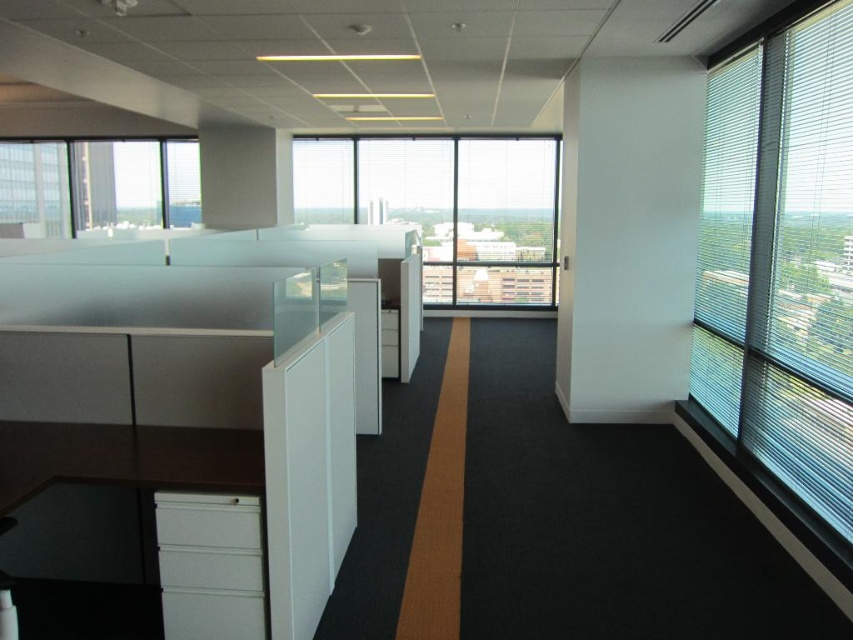
Does transparent glass window at right come in front of clear glass window at upper left?

Yes.

Does point (839, 276) come closer to viewer compared to point (86, 228)?

Yes, point (839, 276) is closer to viewer.

Between point (839, 314) and point (91, 208), which one is positioned behind?

Point (91, 208)

Locate an element on the screen. This screenshot has height=640, width=853. transparent glass window at right is located at coordinates (781, 259).

Does transparent glass window at right have a greater height compared to transparent glass window at center?

Yes.

Between point (809, 77) and point (547, 212), which one is positioned behind?

The point (547, 212) is more distant.

Identify the location of transparent glass window at right. (781, 259).

From the picture: Does transparent glass window at center have a lesser height compared to clear glass window at upper left?

No.

Can you confirm if transparent glass window at center is positioned above clear glass window at upper left?

Actually, transparent glass window at center is below clear glass window at upper left.

This screenshot has width=853, height=640. Describe the element at coordinates (445, 208) in the screenshot. I see `transparent glass window at center` at that location.

In order to click on transparent glass window at center in this screenshot , I will do pyautogui.click(x=445, y=208).